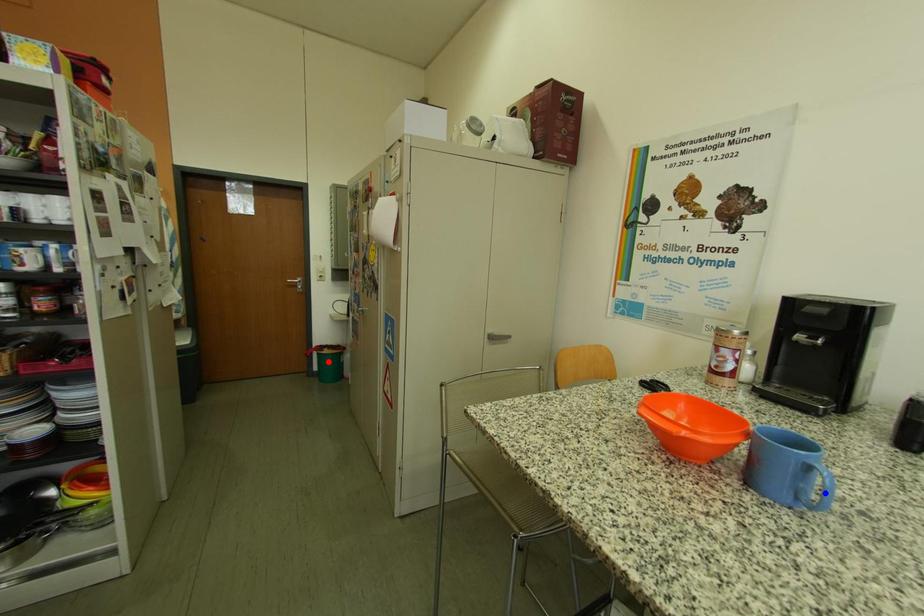
Question: In the image, two points are highlighted. Which point is nearer to the camera? Reply with the corresponding letter.

Choices:
 (A) blue point
 (B) red point

Answer: (A)